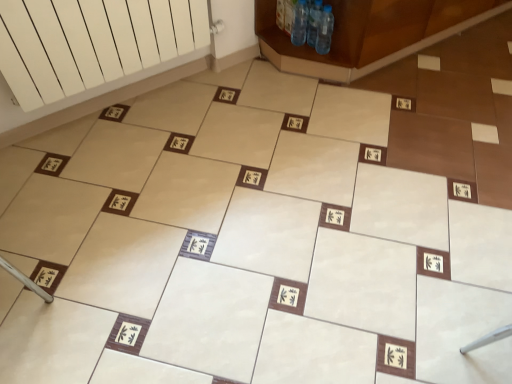
Question: Relative to clear plastic bottle at upper center, which appears as the second bottle when viewed from the left, is brown wooden cabinet at upper right in front or behind?

Choices:
 (A) front
 (B) behind

Answer: (A)

Question: Is brown wooden cabinet at upper right bigger or smaller than clear plastic bottle at upper center, which appears as the second bottle when viewed from the right?

Choices:
 (A) small
 (B) big

Answer: (B)

Question: Estimate the real-world distances between objects in this image. Which object is closer to the brown wooden cabinet at upper right?

Choices:
 (A) transparent plastic bottles at upper center, which is counted as the 3th bottle, starting from the left
 (B) clear plastic bottle at upper center, which appears as the second bottle when viewed from the left
 (C) transparent plastic bottles at upper center, which is counted as the 1th bottle, starting from the left
 (D) white matte radiator at upper left

Answer: (A)

Question: Estimate the real-world distances between objects in this image. Which object is closer to the clear plastic bottle at upper center, which appears as the second bottle when viewed from the right?

Choices:
 (A) transparent plastic bottles at upper center, positioned as the first bottle in right-to-left order
 (B) white matte radiator at upper left
 (C) transparent plastic bottles at upper center, which is the 3th bottle in right-to-left order
 (D) brown wooden cabinet at upper right

Answer: (A)